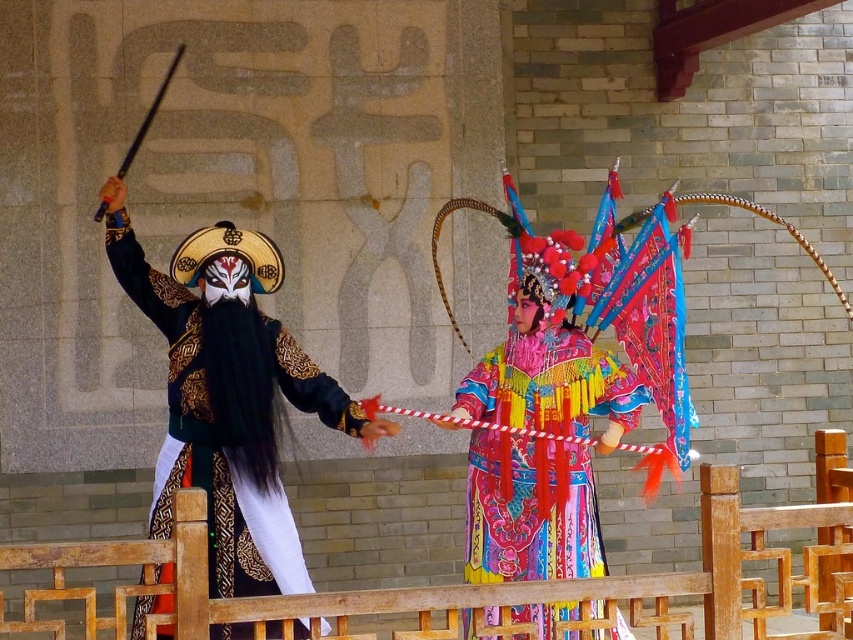
You are an audience member watching the performance. You notice the black satin mask at left and the vibrant silk robe at center. Which object is larger in size?

The black satin mask at left is bigger than the vibrant silk robe at center.

In the scene shown: You are a photographer trying to capture both the black satin mask at left and the vibrant silk robe at center in a single frame. Given their height difference, which object should you adjust your camera angle to focus on to ensure both are visible?

The black satin mask at left is much taller than the vibrant silk robe at center, so you should lower your camera angle to capture the taller black satin mask at left while still including the shorter vibrant silk robe at center in the frame.

You are a photographer trying to capture the performer wearing the vibrant silk robe at center without the black satin mask at left blocking the view. Is the mask currently obstructing your shot?

The black satin mask at left is in front of the vibrant silk robe at center, so it is obstructing the view of the vibrant silk robe at center. To capture the robe without obstruction, you would need to adjust your angle or position to move around the black satin mask at left.